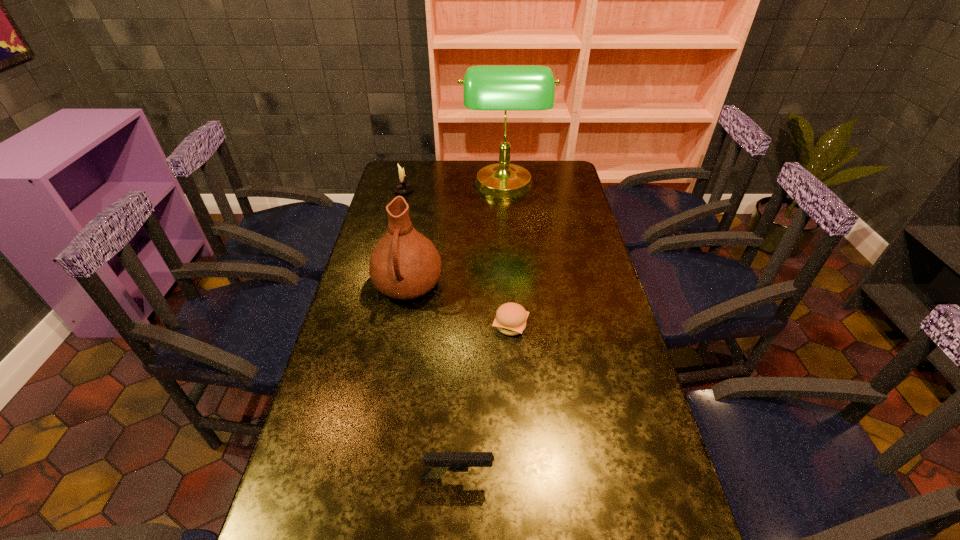
In order to click on free space that satisfies the following two spatial constraints: 1. on the desk next to the lamp; 2. on the front side of the candle holder in this screenshot , I will do `click(504, 191)`.